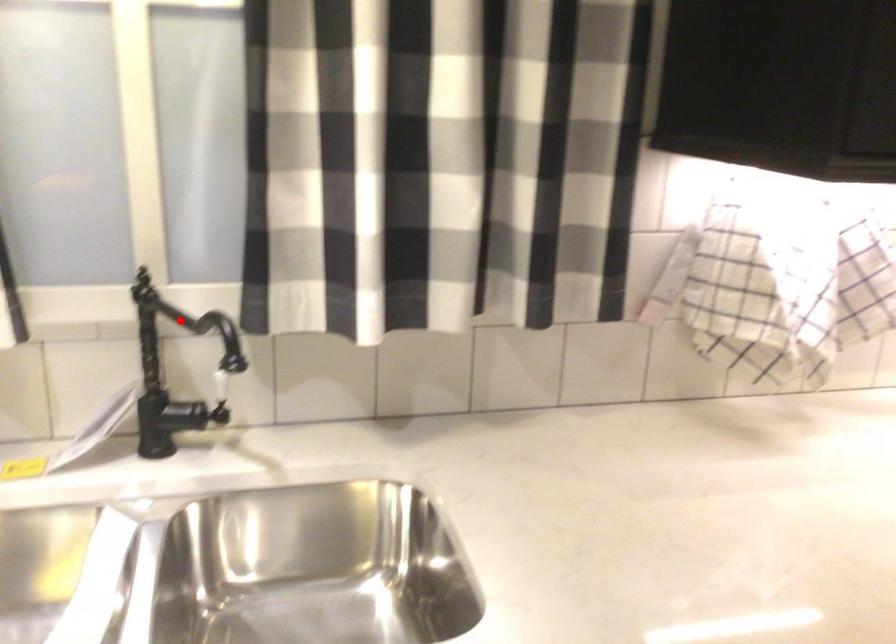
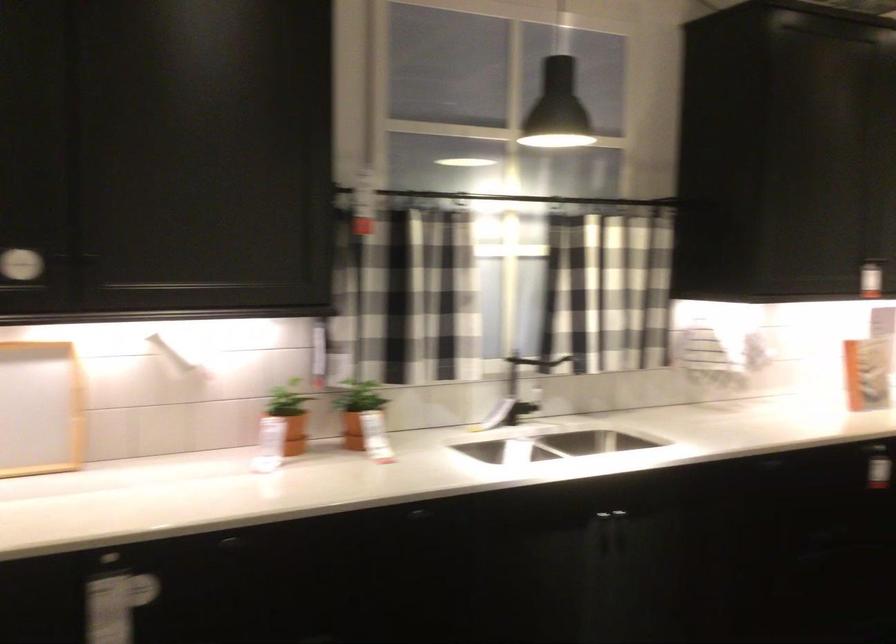
Where in the second image is the point corresponding to the highlighted location from the first image?

(520, 370)